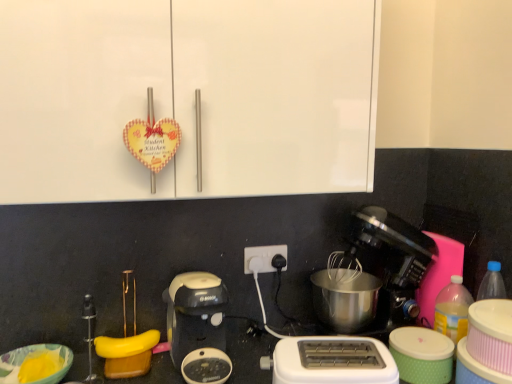
Question: Does point (346, 263) appear closer or farther from the camera than point (153, 344)?

Choices:
 (A) closer
 (B) farther

Answer: (B)

Question: Is black plastic coffee maker at center right, which appears as the first coffee maker when viewed from the right, spatially inside yellow rubber band at lower center, or outside of it?

Choices:
 (A) inside
 (B) outside

Answer: (B)

Question: Which object is positioned farthest from the black plastic power plugs at center?

Choices:
 (A) matte yellow bowl at lower left
 (B) translucent plastic bottle at right
 (C) white plastic toaster at lower center
 (D) green textured container at lower right
 (E) black plastic coffee maker at lower center, which is counted as the first coffee maker, starting from the left

Answer: (A)

Question: Based on their relative distances, which object is farther from the black plastic power plugs at center?

Choices:
 (A) translucent plastic bottle at right
 (B) green textured container at lower right
 (C) white plastic toaster at lower center
 (D) black plastic coffee maker at center right, which appears as the first coffee maker when viewed from the right
 (E) matte yellow bowl at lower left

Answer: (E)